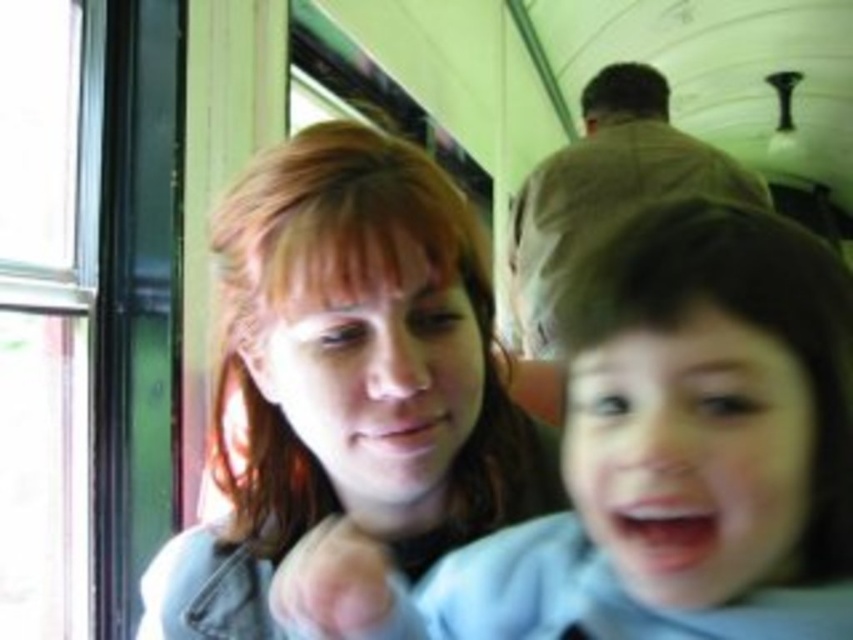
Question: Which object is the closest to the smooth brown hair at center?

Choices:
 (A) smooth skin face at center
 (B) brown fabric coach at upper center

Answer: (A)

Question: Is smooth skin face at center wider than smooth brown hair at center?

Choices:
 (A) no
 (B) yes

Answer: (A)

Question: Does smooth skin face at center appear over smooth brown hair at center?

Choices:
 (A) no
 (B) yes

Answer: (A)

Question: Does smooth skin face at center have a larger size compared to smooth brown hair at center?

Choices:
 (A) no
 (B) yes

Answer: (A)

Question: Among these points, which one is nearest to the camera?

Choices:
 (A) (711, 177)
 (B) (613, 588)

Answer: (B)

Question: Which of the following is the farthest from the observer?

Choices:
 (A) (598, 115)
 (B) (665, 371)

Answer: (A)